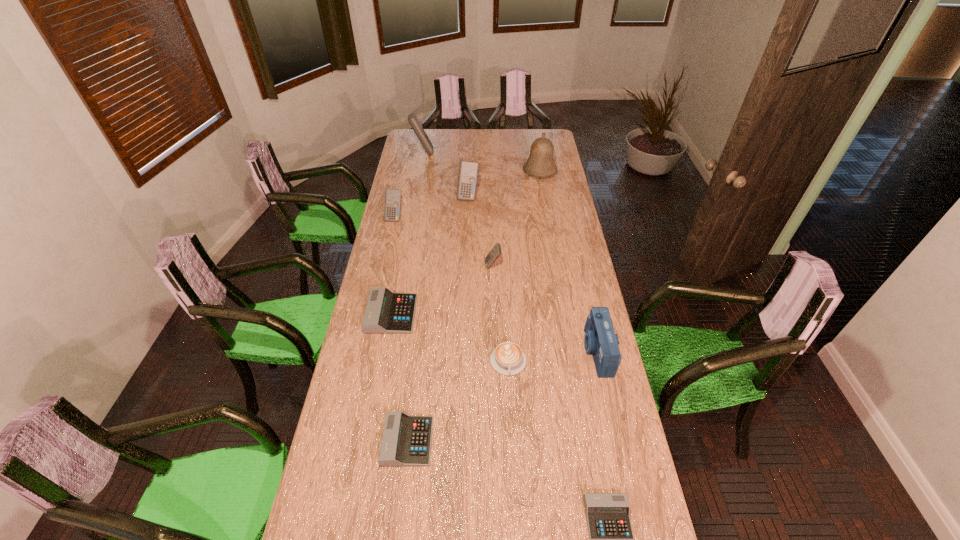
At what (x,y) coordinates should I click in order to perform the action: click on vacant space in between the second farthest gray calculator and the cappuccino. Please return your answer as a coordinate pair (x, y). Looking at the image, I should click on (458, 401).

I want to click on unoccupied position between the rightmost blue calculator and the farthest calculator, so click(458, 209).

Locate which object ranks in proximity to the eighth nearest object. Please provide its 2D coordinates. Your answer should be formatted as a tuple, i.e. [(x, y)], where the tuple contains the x and y coordinates of a point satisfying the conditions above.

[(540, 164)]

Choose which object is the ninth nearest neighbor to the second biggest gray calculator. Please provide its 2D coordinates. Your answer should be formatted as a tuple, i.e. [(x, y)], where the tuple contains the x and y coordinates of a point satisfying the conditions above.

[(412, 118)]

Identify which calculator is located as the second nearest to the sixth calculator from left to right. Please provide its 2D coordinates. Your answer should be formatted as a tuple, i.e. [(x, y)], where the tuple contains the x and y coordinates of a point satisfying the conditions above.

[(468, 171)]

Identify which calculator is the sixth closest to the rightmost gray calculator. Please provide its 2D coordinates. Your answer should be formatted as a tuple, i.e. [(x, y)], where the tuple contains the x and y coordinates of a point satisfying the conditions above.

[(412, 118)]

The height and width of the screenshot is (540, 960). What are the coordinates of `blue calculator object that ranks as the closest to the cappuccino` in the screenshot? It's located at (493, 255).

Locate an element on the screen. This screenshot has width=960, height=540. blue calculator that is the closest to the cappuccino is located at coordinates (493, 255).

I want to click on gray calculator object that ranks as the closest to the second farthest gray calculator, so click(386, 312).

This screenshot has height=540, width=960. What are the coordinates of `gray calculator object that ranks as the closest to the bell` in the screenshot? It's located at (386, 312).